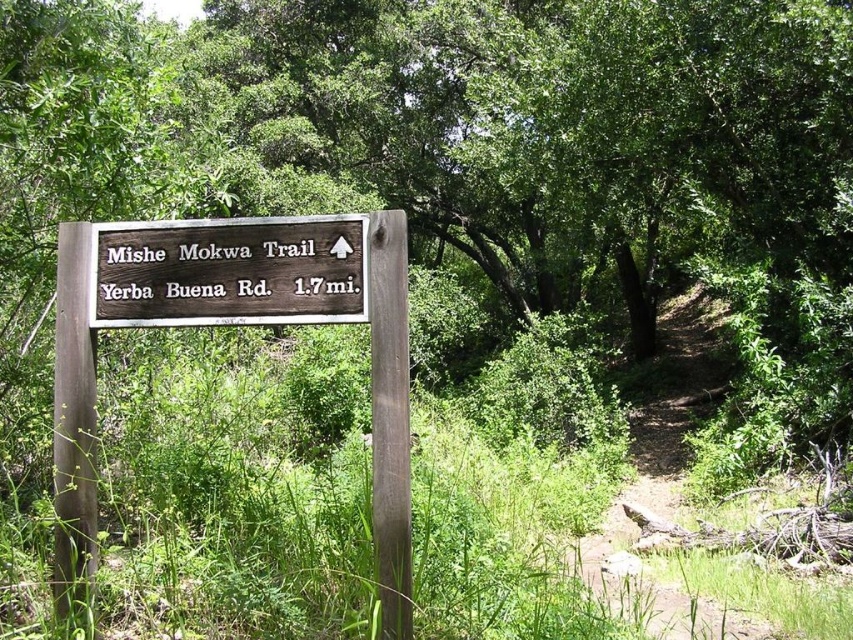
Question: Is wooden sign at center above brown wooden sign at center?

Choices:
 (A) yes
 (B) no

Answer: (B)

Question: Which object is closer to the camera taking this photo?

Choices:
 (A) brown wooden sign at center
 (B) dirt path at center

Answer: (A)

Question: Which point is farther to the camera?

Choices:
 (A) (61, 394)
 (B) (253, 250)
 (C) (641, 396)

Answer: (C)

Question: Considering the relative positions of brown wooden sign at center and dirt path at center in the image provided, where is brown wooden sign at center located with respect to dirt path at center?

Choices:
 (A) below
 (B) above

Answer: (B)

Question: Which object is the farthest from the wooden sign at center?

Choices:
 (A) dirt path at center
 (B) brown wooden sign at center

Answer: (A)

Question: In this image, where is brown wooden sign at center located relative to dirt path at center?

Choices:
 (A) above
 (B) below

Answer: (A)